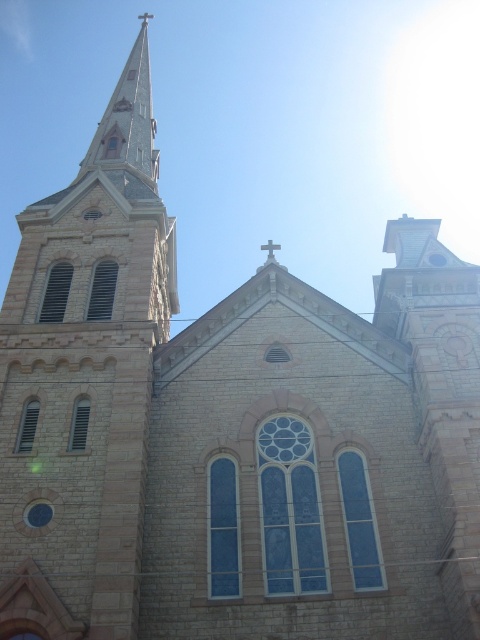
In the scene shown: Can you confirm if light gray stone steeple at upper left is positioned below metallic cross at center?

Incorrect, light gray stone steeple at upper left is not positioned below metallic cross at center.

Is light gray stone steeple at upper left positioned behind metallic cross at center?

No, light gray stone steeple at upper left is closer to the viewer.

Measure the distance between light gray stone steeple at upper left and camera.

light gray stone steeple at upper left is 108.17 feet away from camera.

Where is `light gray stone steeple at upper left`? This screenshot has height=640, width=480. light gray stone steeple at upper left is located at coordinates (84, 380).

Can you confirm if light gray stone steeple at upper left is bigger than metallic cross at upper center?

Yes.

Measure the distance between light gray stone steeple at upper left and metallic cross at upper center.

144.71 meters

Which is behind, point (11, 618) or point (142, 22)?

The point (142, 22) is more distant.

Where is `light gray stone steeple at upper left`? light gray stone steeple at upper left is located at coordinates (84, 380).

Can you confirm if metallic cross at center is positioned to the right of metallic cross at upper center?

Yes, metallic cross at center is to the right of metallic cross at upper center.

Which is more to the left, metallic cross at center or metallic cross at upper center?

From the viewer's perspective, metallic cross at upper center appears more on the left side.

Measure the distance between point (x=271, y=256) and camera.

Point (x=271, y=256) and camera are 179.42 feet apart.

Identify the location of metallic cross at center. This screenshot has height=640, width=480. click(269, 248).